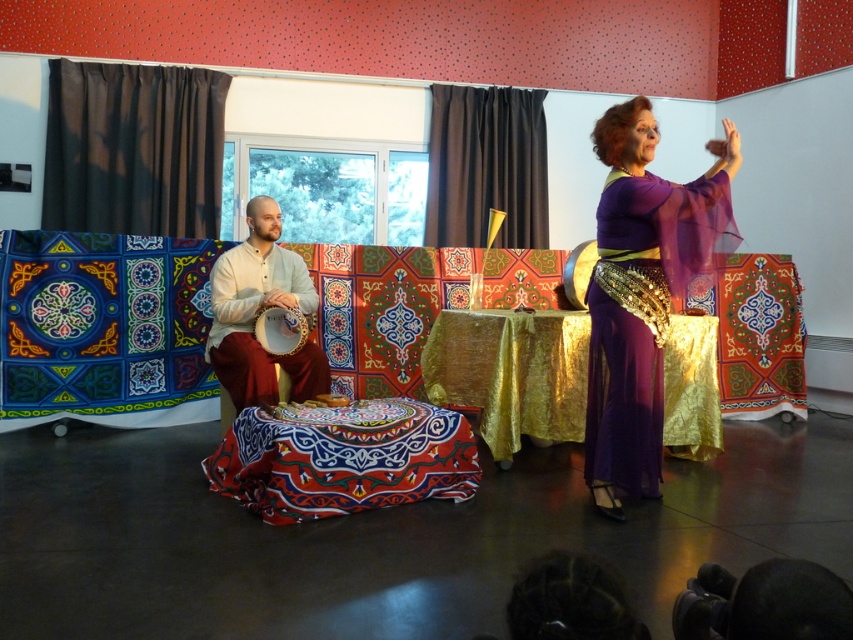
Question: Which object is positioned closest to the embroidered fabric ottoman at center?

Choices:
 (A) black fabric curtain at upper center
 (B) gold shimmering tablecloth at center
 (C) purple chiffon dress at center
 (D) wooden drum at center

Answer: (D)

Question: Is light beige cotton drum at left thinner than wooden drum at center?

Choices:
 (A) no
 (B) yes

Answer: (A)

Question: Estimate the real-world distances between objects in this image. Which object is farther from the gold shimmering tablecloth at center?

Choices:
 (A) light beige cotton drum at left
 (B) wooden drum at center
 (C) purple chiffon dress at center
 (D) black fabric curtain at upper center

Answer: (D)

Question: Is black curtain at left to the left of light beige cotton drum at left from the viewer's perspective?

Choices:
 (A) yes
 (B) no

Answer: (A)

Question: Among these points, which one is farthest from the camera?

Choices:
 (A) (438, 138)
 (B) (469, 310)
 (C) (256, 474)
 (D) (630, 164)

Answer: (A)

Question: Does purple chiffon dress at center appear over black fabric curtain at upper center?

Choices:
 (A) yes
 (B) no

Answer: (B)